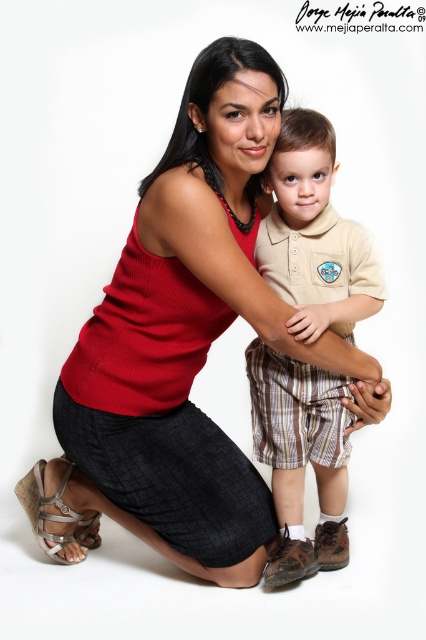
Is point (311, 392) farther from viewer compared to point (63, 540)?

That is False.

Based on the photo, who is positioned more to the right, beige cotton polo shirt at center or silver metallic sandal at lower left?

beige cotton polo shirt at center is more to the right.

Which is behind, point (287, 147) or point (37, 488)?

Point (37, 488)

Locate an element on the screen. This screenshot has height=640, width=426. beige cotton polo shirt at center is located at coordinates (314, 236).

Does matte red tank top at center appear over silver metallic sandal at lower left?

Yes.

Between matte red tank top at center and silver metallic sandal at lower left, which one is positioned lower?

silver metallic sandal at lower left is below.

Which is in front, point (198, 148) or point (28, 500)?

Point (198, 148)

The height and width of the screenshot is (640, 426). I want to click on matte red tank top at center, so click(x=190, y=336).

Who is higher up, matte red tank top at center or beige cotton polo shirt at center?

matte red tank top at center

Does point (103, 310) come farther from viewer compared to point (310, 141)?

Yes.

What do you see at coordinates (190, 336) in the screenshot?
I see `matte red tank top at center` at bounding box center [190, 336].

The width and height of the screenshot is (426, 640). Find the location of `matte red tank top at center`. matte red tank top at center is located at coordinates (190, 336).